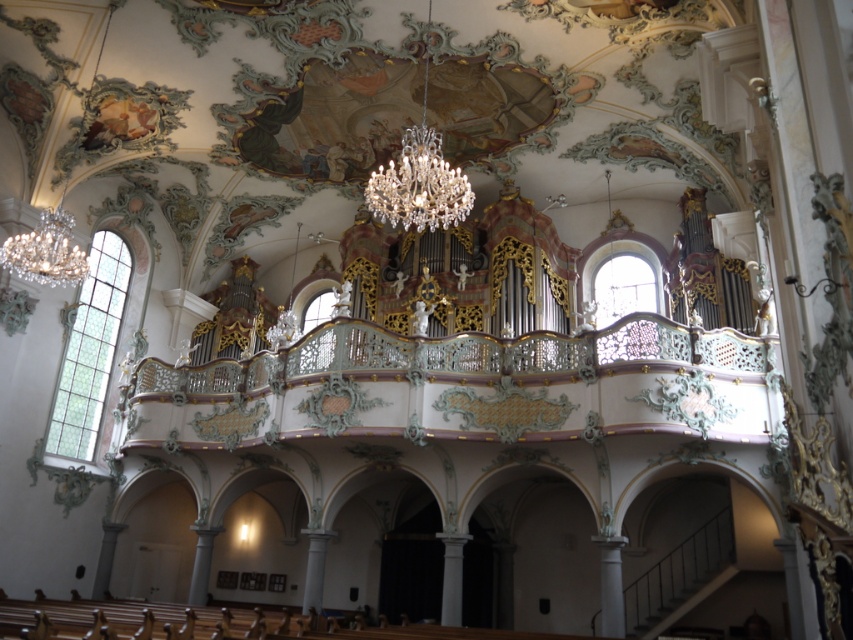
Between pastel green ornate balcony at center and crystal glass chandelier at upper center, which one appears on the right side from the viewer's perspective?

From the viewer's perspective, pastel green ornate balcony at center appears more on the right side.

Does pastel green ornate balcony at center lie in front of crystal glass chandelier at upper center?

Yes, it is.

Measure the distance between point (741, 416) and camera.

The distance of point (741, 416) from camera is 54.41 meters.

At what (x,y) coordinates should I click in order to perform the action: click on pastel green ornate balcony at center. Please return your answer as a coordinate pair (x, y). Looking at the image, I should click on (468, 387).